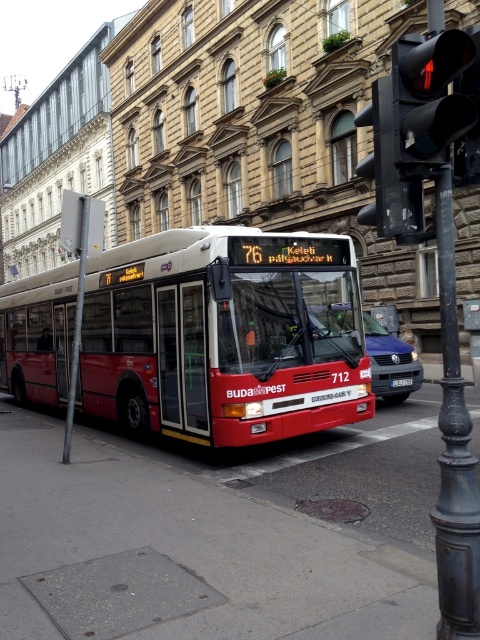
Is matte red bus at center bigger than black glass traffic light at upper right?

Yes, matte red bus at center is bigger than black glass traffic light at upper right.

Can you confirm if matte red bus at center is shorter than black glass traffic light at upper right?

Incorrect, matte red bus at center's height does not fall short of black glass traffic light at upper right's.

Is point (145, 316) positioned in front of point (470, 93)?

No, it is behind (470, 93).

I want to click on matte red bus at center, so click(225, 336).

Is point (474, 589) less distant than point (398, 202)?

Yes, it is.

Which of these two, black metal traffic light at right or black plastic traffic light at upper right, stands taller?

black plastic traffic light at upper right is taller.

Is point (460, 412) farther from viewer compared to point (391, 195)?

No, (460, 412) is in front of (391, 195).

Locate an element on the screen. This screenshot has height=640, width=480. black metal traffic light at right is located at coordinates (454, 449).

Is point (376, 218) farther from camera compared to point (405, 385)?

No, it is in front of (405, 385).

Image resolution: width=480 pixels, height=640 pixels. What are the coordinates of `black plastic traffic light at upper right` in the screenshot? It's located at (387, 173).